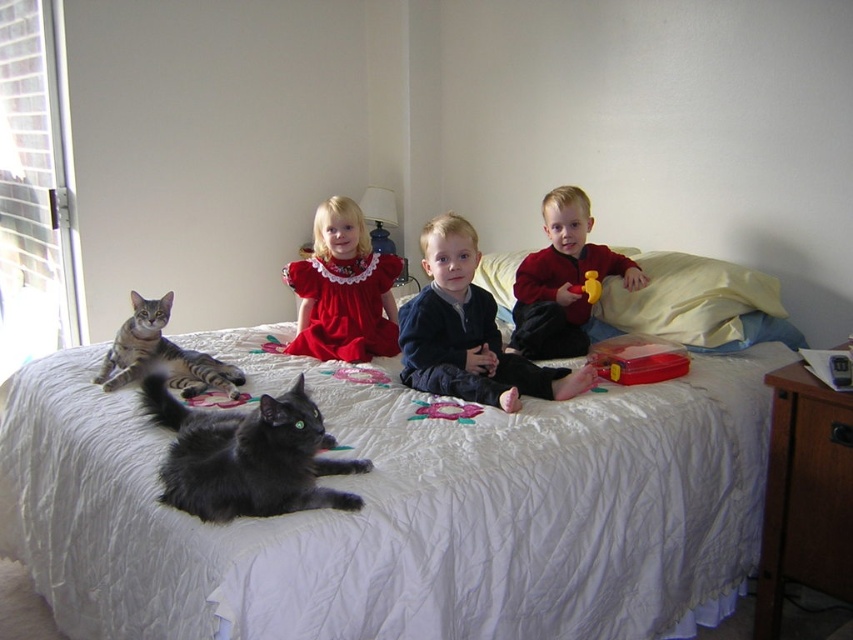
You are taking a photo of two points in the scene. The first point is at coordinates point (x=554, y=321) and the second point is at point (x=387, y=385). Which point will appear larger in your photo?

Point (x=554, y=321) is further to the camera than point (x=387, y=385), so it will appear larger in the photo.

You are a parent trying to organize toys on a narrow shelf. You have the translucent plastic toy at center and the yellow rubber duck at center right. Which toy should you place first to ensure both fit on the shelf?

The yellow rubber duck at center right should be placed first since it is narrower than the translucent plastic toy at center, allowing both to fit on the narrow shelf.

In the scene described, there are three children sitting on a bed with two cats. The bed has a white quilted cover with colorful embroidered patterns. The children are wearing different clothes. The embroidered fabric flower at center is represented by point (445, 410). Which child is closest to the embroidered fabric flower at center?

The child wearing a red dress with lace trim is closest to the embroidered fabric flower at center.